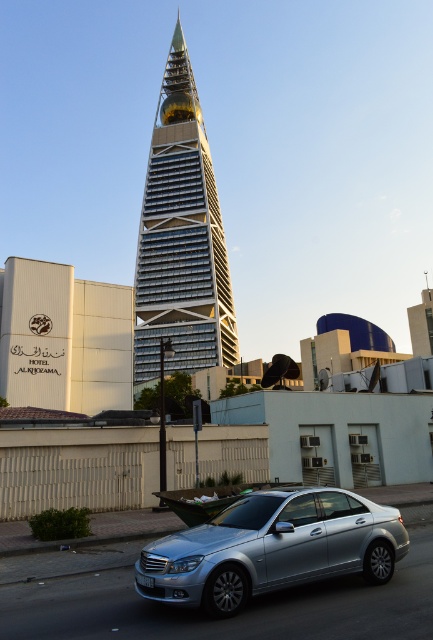
You are a city planner assessing the urban layout. Given that both the silver metallic skyscraper at center and the silver metallic car at center are in the same image, which one has a greater width?

The silver metallic skyscraper at center has a greater width than the silver metallic car at center, as stated in the description.

You are standing on the street in front of the skyscraper and want to place a small flag at two specific points. The first point is at coordinates point (x=161, y=248) and the second is at point (x=209, y=536). Which point should you place the flag closer to the skyscraper?

Point (x=209, y=536) is closer to the skyscraper because it is further away from the viewer compared to point (x=161, y=248).

You are a delivery drone that needs to fly from the silver metallic skyscraper at center to the silver metallic car at center. What is the minimum horizontal distance you must cover?

The minimum horizontal distance between the silver metallic skyscraper at center and the silver metallic car at center is 88.33 meters, so the drone must cover at least 88.33 meters.